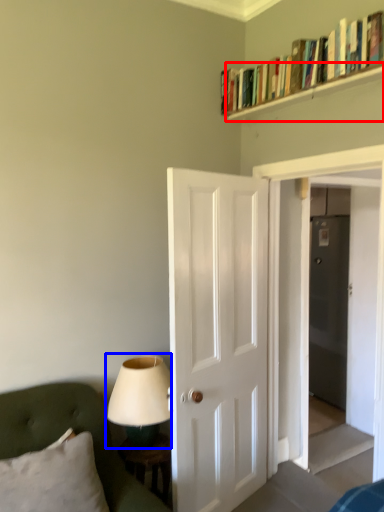
Question: Which point is further to the camera, shelf (highlighted by a red box) or table lamp (highlighted by a blue box)?

Choices:
 (A) shelf
 (B) table lamp

Answer: (B)